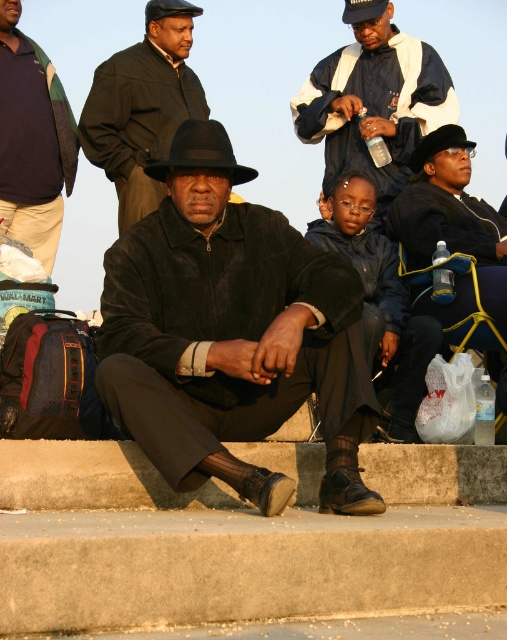
Does dark blue cotton shirt at upper left have a larger size compared to black felt hat at upper right?

Indeed, dark blue cotton shirt at upper left has a larger size compared to black felt hat at upper right.

At what (x,y) coordinates should I click in order to perform the action: click on dark blue cotton shirt at upper left. Please return your answer as a coordinate pair (x, y). Looking at the image, I should click on (32, 140).

I want to click on dark blue cotton shirt at upper left, so click(x=32, y=140).

Is black felt hat at upper right shorter than dark blue leather cap at upper center?

Incorrect, black felt hat at upper right's height does not fall short of dark blue leather cap at upper center's.

Can you confirm if black felt hat at upper right is positioned above dark blue leather cap at upper center?

Actually, black felt hat at upper right is below dark blue leather cap at upper center.

Locate an element on the screen. Image resolution: width=507 pixels, height=640 pixels. black felt hat at upper right is located at coordinates (438, 145).

Locate an element on the screen. This screenshot has width=507, height=640. black felt hat at upper right is located at coordinates (438, 145).

Can you confirm if matte black coat at upper center is wider than black felt fedora at center?

Correct, the width of matte black coat at upper center exceeds that of black felt fedora at center.

Is matte black coat at upper center further to the viewer compared to black felt fedora at center?

That is True.

The height and width of the screenshot is (640, 507). What do you see at coordinates (140, 113) in the screenshot? I see `matte black coat at upper center` at bounding box center [140, 113].

This screenshot has width=507, height=640. In order to click on matte black coat at upper center in this screenshot , I will do `click(140, 113)`.